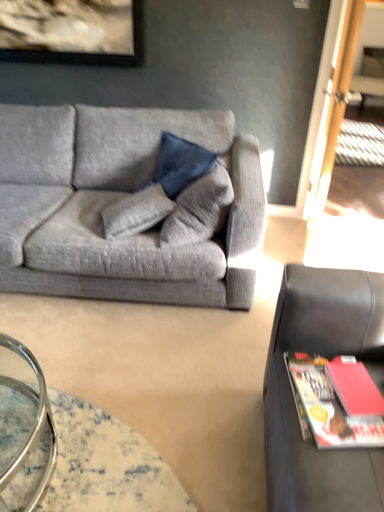
Question: Relative to textured gray couch at left, which is counted as the second studio couch, starting from the right, is black leather studio couch at right, positioned as the first studio couch in front-to-back order, in front or behind?

Choices:
 (A) front
 (B) behind

Answer: (A)

Question: Does point (281, 304) appear closer or farther from the camera than point (51, 151)?

Choices:
 (A) closer
 (B) farther

Answer: (A)

Question: Based on their relative distances, which object is nearer to the matte red book at lower right?

Choices:
 (A) black leather studio couch at right, positioned as the first studio couch in front-to-back order
 (B) textured gray couch at left, which is counted as the second studio couch, starting from the right
 (C) translucent glass table at lower left
 (D) red matte magazine at right

Answer: (D)

Question: Which object is the closest to the translucent glass table at lower left?

Choices:
 (A) matte red book at lower right
 (B) textured gray couch at left, the 2th studio couch when ordered from front to back
 (C) red matte magazine at right
 (D) black leather studio couch at right, which appears as the second studio couch when viewed from the back

Answer: (D)